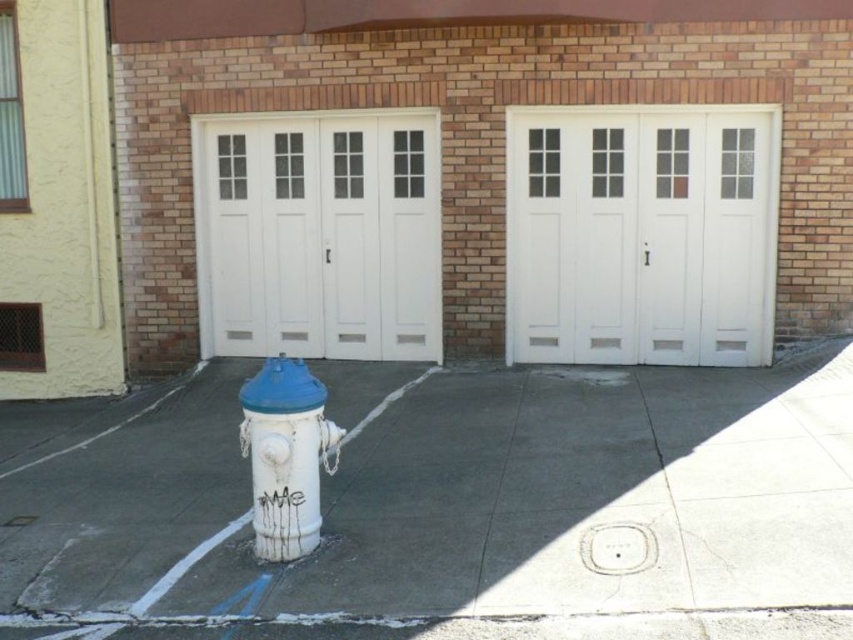
Question: Among these points, which one is farthest from the camera?

Choices:
 (A) (271, 445)
 (B) (618, 248)

Answer: (B)

Question: Based on their relative distances, which object is farther from the white matte hydrant at lower left?

Choices:
 (A) white concrete pavement at center
 (B) white painted wood garage door at center

Answer: (B)

Question: Is white concrete pavement at center to the left of white painted wood garage door at center from the viewer's perspective?

Choices:
 (A) yes
 (B) no

Answer: (A)

Question: Is white concrete pavement at center above white matte hydrant at lower left?

Choices:
 (A) yes
 (B) no

Answer: (B)

Question: Can you confirm if white concrete pavement at center is positioned below white matte hydrant at lower left?

Choices:
 (A) yes
 (B) no

Answer: (A)

Question: Which point appears farthest from the camera in this image?

Choices:
 (A) (231, 192)
 (B) (310, 529)
 (C) (755, 131)
 (D) (129, 436)

Answer: (A)